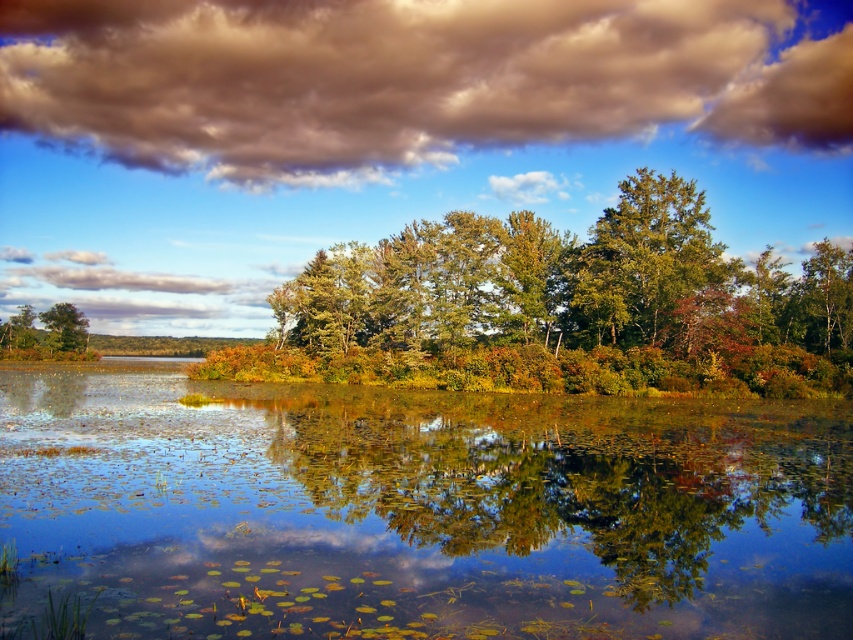
Is point (656, 92) positioned before point (280, 371)?

No, (656, 92) is behind (280, 371).

This screenshot has height=640, width=853. Identify the location of cloudy sky at upper center. (407, 80).

Between point (503, 19) and point (334, 259), which one is positioned in front?

Positioned in front is point (334, 259).

Find the location of `cloudy sky at upper center`. cloudy sky at upper center is located at coordinates (407, 80).

Is point (437, 474) less distant than point (752, 20)?

Yes, it is in front of point (752, 20).

Locate an element on the screen. Image resolution: width=853 pixels, height=640 pixels. green leafy water at center is located at coordinates (418, 509).

The image size is (853, 640). Describe the element at coordinates (418, 509) in the screenshot. I see `green leafy water at center` at that location.

Between green leafy water at center and green matte tree at left, which one is positioned higher?

green matte tree at left

Between point (666, 468) and point (82, 326), which one is positioned behind?

Positioned behind is point (82, 326).

The height and width of the screenshot is (640, 853). Find the location of `green leafy water at center`. green leafy water at center is located at coordinates (418, 509).